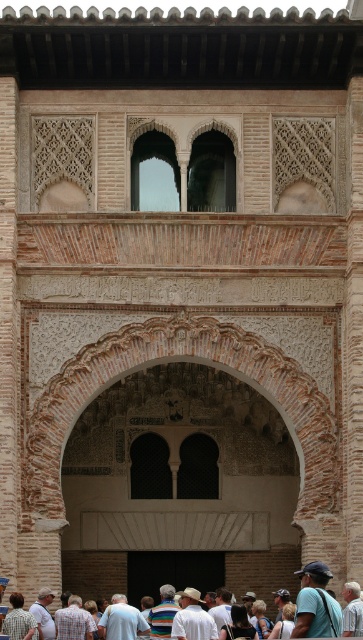
You are standing in front of a historic building with intricate Islamic architecture. You notice two shirts in the scene. The light blue shirt at lower left and the white cotton shirt at center. Which shirt is positioned more to the left side of the scene?

The light blue shirt at lower left is positioned more to the left side of the scene as it is to the left of the white cotton shirt at center.

You are standing in front of a historic building and notice two shirts hanging on a clothesline between two arches. The shirts are the light blue shirt at lower left and the white cotton shirt at center. If you want to retrieve both shirts without moving from your current position, can you reach both shirts if your maximum reach is 10 meters?

The light blue shirt at lower left and the white cotton shirt at center are 9.06 meters apart. Since your maximum reach is 10 meters, you can reach both shirts as the distance between them is within your reach capability.

In the image of the historic Islamic architecture, there is a point marked at coordinates (18, 620). Based on the scene description, what object or feature does this point correspond to?

The point at coordinates (18, 620) corresponds to the light blue shirt at lower left.